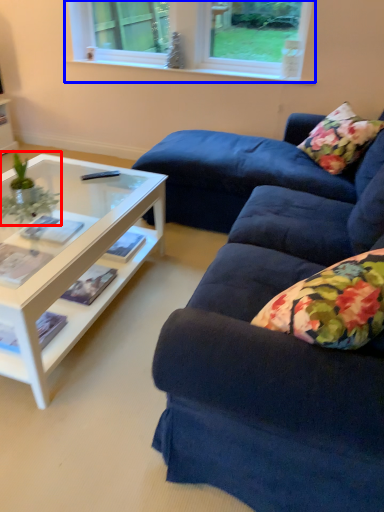
Question: Among these objects, which one is nearest to the camera, houseplant (highlighted by a red box) or window (highlighted by a blue box)?

Choices:
 (A) houseplant
 (B) window

Answer: (A)